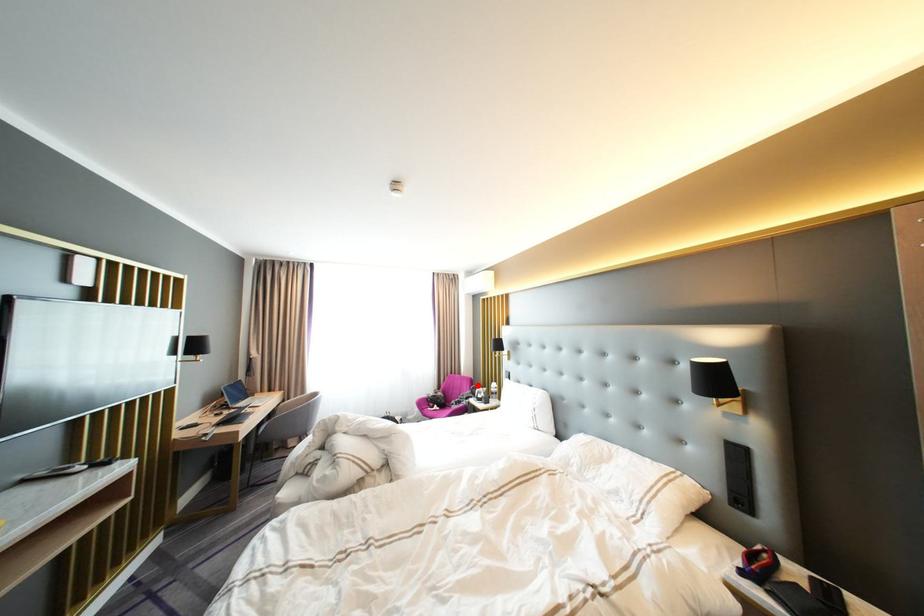
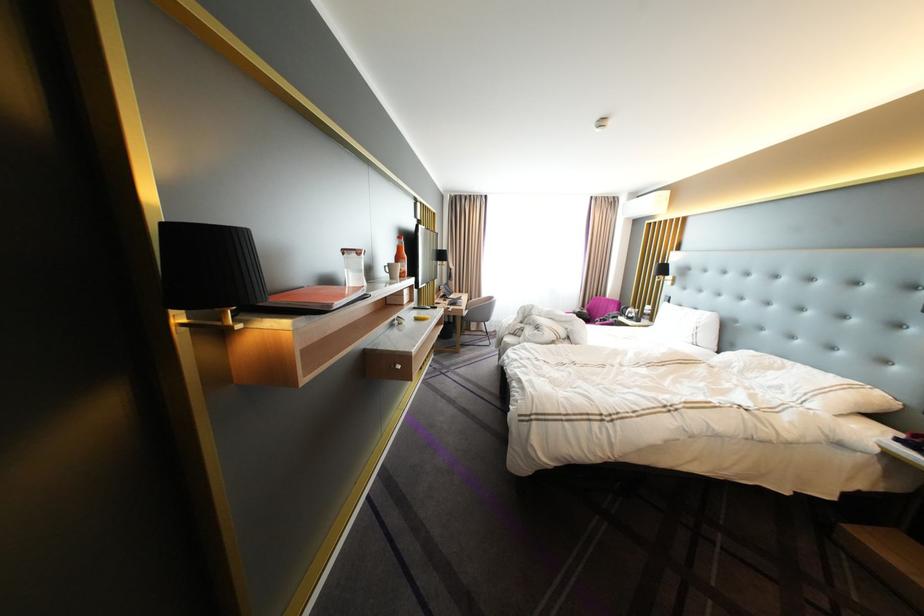
In the second image, find the point that corresponds to the highlighted location in the first image.

(625, 307)